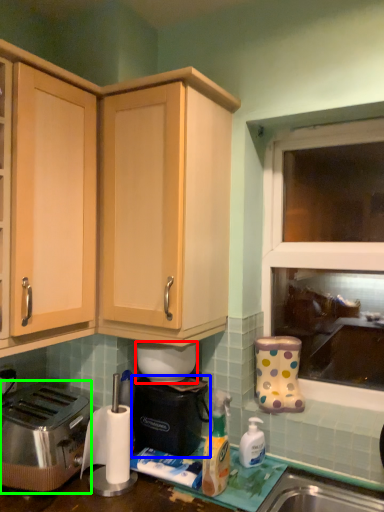
Question: Which object is positioned closest to appliance (highlighted by a red box)? Select from appliance (highlighted by a blue box) and toaster (highlighted by a green box).

Choices:
 (A) appliance
 (B) toaster

Answer: (A)